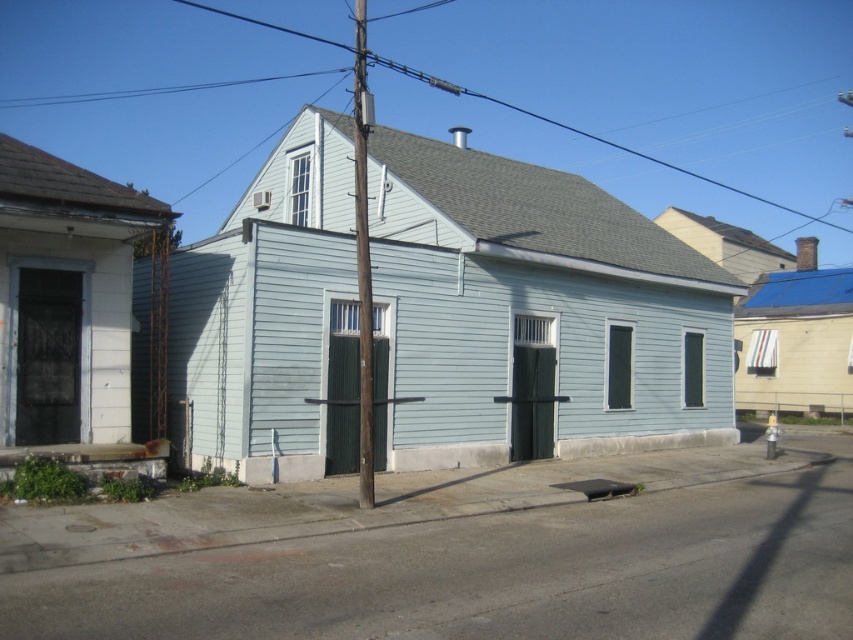
Is brown wooden telegraph pole at center to the right of gray wire at upper center from the viewer's perspective?

No, brown wooden telegraph pole at center is not to the right of gray wire at upper center.

Measure the distance between brown wooden telegraph pole at center and gray wire at upper center.

They are 83.76 feet apart.

Locate an element on the screen. Image resolution: width=853 pixels, height=640 pixels. brown wooden telegraph pole at center is located at coordinates (363, 260).